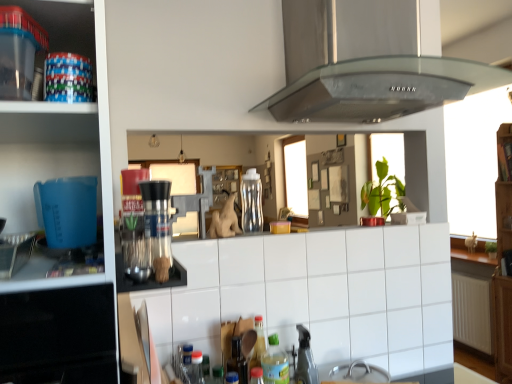
Question: From a real-world perspective, is transparent plastic containers at upper left physically located above or below white tile at center?

Choices:
 (A) above
 (B) below

Answer: (A)

Question: Is transparent plastic containers at upper left inside the boundaries of white tile at center, or outside?

Choices:
 (A) outside
 (B) inside

Answer: (A)

Question: Which of these objects is positioned farthest from the stainless steel range hood at upper center?

Choices:
 (A) satin silver coffee machine at center
 (B) wooden shelf at upper right
 (C) white tile at center
 (D) transparent plastic bottle at center, which is the second bottle from bottom to top
 (E) metallic silver faucet at lower center

Answer: (B)

Question: Considering the real-world distances, which object is farthest from the metallic silver faucet at lower center?

Choices:
 (A) transparent plastic containers at upper left
 (B) white tile at center
 (C) transparent plastic bottle at center, marked as the second bottle in a front-to-back arrangement
 (D) satin silver coffee machine at center
 (E) wooden shelf at upper right

Answer: (E)